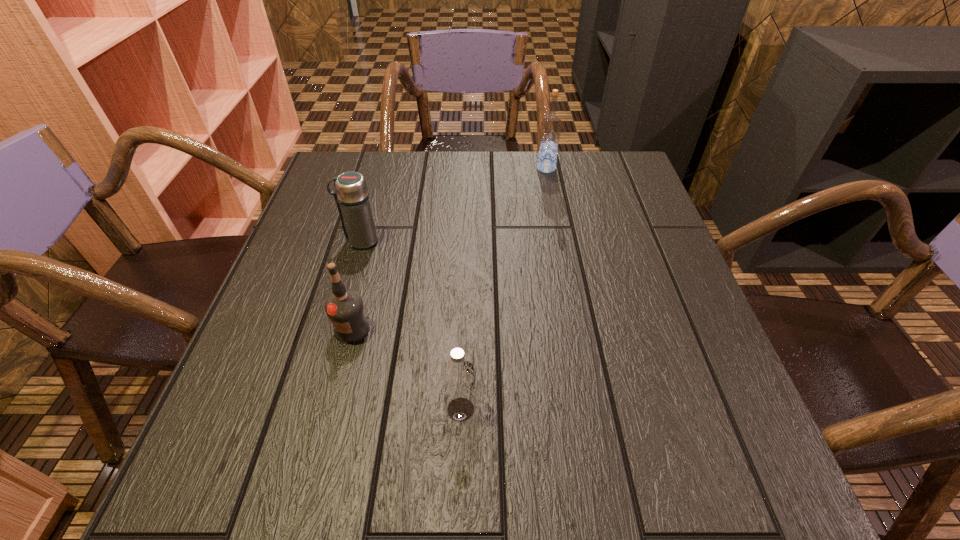
Where is `free area in between the third nearest object and the third object from left to right`? This screenshot has width=960, height=540. free area in between the third nearest object and the third object from left to right is located at coordinates (411, 325).

The width and height of the screenshot is (960, 540). What are the coordinates of `free space that is in between the second vodka from right to left and the rightmost object` in the screenshot? It's located at (503, 289).

Find the location of a particular element. This screenshot has height=540, width=960. free spot between the third nearest object and the second farthest vodka is located at coordinates (356, 285).

You are a GUI agent. You are given a task and a screenshot of the screen. Output one action in this format:
    pyautogui.click(x=<x>, y=<y>)
    Task: Click on the unoccupied position between the third object from left to right and the farthest object
    The image size is (960, 540).
    Given the screenshot: What is the action you would take?
    pyautogui.click(x=503, y=289)

In order to click on free space between the farthest object and the leftmost vodka in this screenshot , I will do `click(449, 249)`.

This screenshot has height=540, width=960. In order to click on free space between the second vodka from left to right and the leftmost vodka in this screenshot , I will do `click(406, 369)`.

Image resolution: width=960 pixels, height=540 pixels. Find the location of `free space between the thermos bottle and the farthest vodka`. free space between the thermos bottle and the farthest vodka is located at coordinates (453, 205).

Image resolution: width=960 pixels, height=540 pixels. I want to click on unoccupied position between the second vodka from left to right and the second nearest vodka, so click(x=406, y=369).

Find the location of `free spot between the nearest vodka and the farthest object`. free spot between the nearest vodka and the farthest object is located at coordinates (503, 289).

At what (x,y) coordinates should I click in order to perform the action: click on vacant region between the thermos bottle and the nearest vodka. Please return your answer as a coordinate pair (x, y). Looking at the image, I should click on (411, 325).